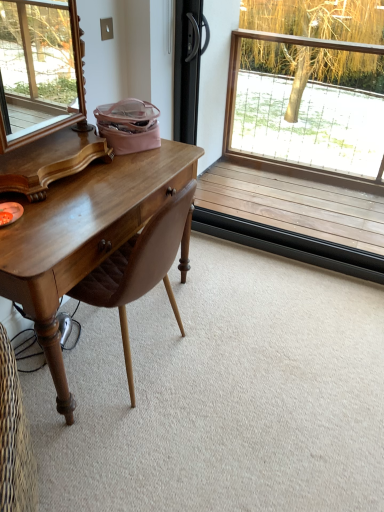
Describe the element at coordinates (310, 86) in the screenshot. I see `wooden frame at upper right` at that location.

Identify the location of wooden frame at upper right. (310, 86).

This screenshot has width=384, height=512. What do you see at coordinates (139, 268) in the screenshot? I see `brown leather chair at left` at bounding box center [139, 268].

The image size is (384, 512). In order to click on brown leather chair at left in this screenshot , I will do `click(139, 268)`.

Locate an element on the screen. This screenshot has width=384, height=512. wooden frame at upper right is located at coordinates (310, 86).

Between brown leather chair at left and wooden frame at upper right, which one appears on the right side from the viewer's perspective?

wooden frame at upper right.

Looking at this image, which is in front, brown leather chair at left or wooden frame at upper right?

brown leather chair at left is in front.

Considering the points (170, 257) and (309, 16), which point is in front, point (170, 257) or point (309, 16)?

The point (170, 257) is closer to the camera.

From the image's perspective, is brown leather chair at left under wooden frame at upper right?

Yes, from the image's perspective, brown leather chair at left is beneath wooden frame at upper right.

From a real-world perspective, is brown leather chair at left physically above wooden frame at upper right?

Incorrect, from a real-world perspective, brown leather chair at left is lower than wooden frame at upper right.

Is brown leather chair at left wider or thinner than wooden frame at upper right?

Clearly, brown leather chair at left has more width compared to wooden frame at upper right.

In terms of height, does brown leather chair at left look taller or shorter compared to wooden frame at upper right?

Clearly, brown leather chair at left is shorter compared to wooden frame at upper right.

Who is bigger, brown leather chair at left or wooden frame at upper right?

With larger size is brown leather chair at left.

From the picture: Is brown leather chair at left positioned beyond the bounds of wooden frame at upper right?

Yes, brown leather chair at left is outside of wooden frame at upper right.

Are brown leather chair at left and wooden frame at upper right located far from each other?

Indeed, brown leather chair at left is not near wooden frame at upper right.

Is wooden frame at upper right at the back of brown leather chair at left?

No, brown leather chair at left's orientation is not away from wooden frame at upper right.

How many degrees apart are the facing directions of brown leather chair at left and wooden frame at upper right?

90.3 degrees separate the facing orientations of brown leather chair at left and wooden frame at upper right.

You are a GUI agent. You are given a task and a screenshot of the screen. Output one action in this format:
    pyautogui.click(x=<x>, y=<y>)
    Task: Click on the window behind the brown leather chair at left
    
    Given the screenshot: What is the action you would take?
    pyautogui.click(x=310, y=86)

Would you say wooden frame at upper right is to the left or to the right of brown leather chair at left in the picture?

Based on their positions, wooden frame at upper right is located to the right of brown leather chair at left.

Based on the photo, between wooden frame at upper right and brown leather chair at left, which one is positioned in front?

brown leather chair at left.

Considering the positions of point (365, 48) and point (135, 283), is point (365, 48) closer or farther from the camera than point (135, 283)?

Point (365, 48) appears to be farther away from the viewer than point (135, 283).

From the image's perspective, is wooden frame at upper right located above or below brown leather chair at left?

wooden frame at upper right is situated higher than brown leather chair at left in the image.

From a real-world perspective, is wooden frame at upper right physically above brown leather chair at left?

Yes, from a real-world perspective, wooden frame at upper right is above brown leather chair at left.

Which of these two, wooden frame at upper right or brown leather chair at left, is wider?

With larger width is brown leather chair at left.

Considering the sizes of objects wooden frame at upper right and brown leather chair at left in the image provided, who is taller, wooden frame at upper right or brown leather chair at left?

wooden frame at upper right.

Which of these two, wooden frame at upper right or brown leather chair at left, is smaller?

With smaller size is wooden frame at upper right.

Would you say wooden frame at upper right is outside brown leather chair at left?

wooden frame at upper right is positioned outside brown leather chair at left.

In the scene shown: Are wooden frame at upper right and brown leather chair at left far apart?

Absolutely, wooden frame at upper right is distant from brown leather chair at left.

Is wooden frame at upper right turned away from brown leather chair at left?

No, wooden frame at upper right is not facing away from brown leather chair at left.

How distant is wooden frame at upper right from brown leather chair at left?

The distance of wooden frame at upper right from brown leather chair at left is 7.57 feet.

Image resolution: width=384 pixels, height=512 pixels. Find the location of `chair directly beneath the wooden frame at upper right (from a real-world perspective)`. chair directly beneath the wooden frame at upper right (from a real-world perspective) is located at coordinates (139, 268).

Image resolution: width=384 pixels, height=512 pixels. I want to click on window that is above the brown leather chair at left (from a real-world perspective), so click(310, 86).

Identify the location of chair on the left of wooden frame at upper right. (139, 268).